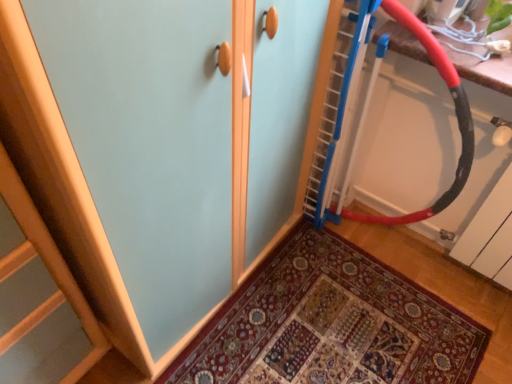
The width and height of the screenshot is (512, 384). Find the location of `vacant area on top of wooden door at center (from a real-world perspective)`. vacant area on top of wooden door at center (from a real-world perspective) is located at coordinates (333, 330).